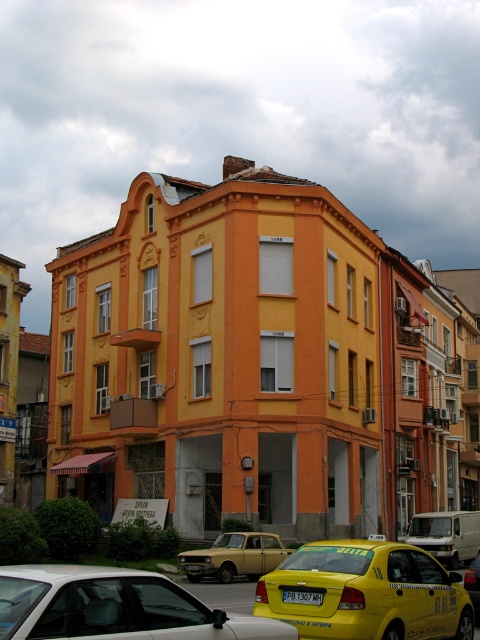
Question: Which of the following is the closest to the observer?

Choices:
 (A) yellow metallic taxi at center
 (B) yellow matte taxi at center

Answer: (B)

Question: Estimate the real-world distances between objects in this image. Which object is farther from the yellow metallic taxi at center?

Choices:
 (A) yellow matte taxi at lower right
 (B) yellow matte taxi at lower center
 (C) gold metallic sedan at center

Answer: (A)

Question: Which is farther from the gold metallic sedan at center?

Choices:
 (A) yellow matte taxi at lower center
 (B) yellow metallic taxi at center
 (C) yellow matte taxi at lower right

Answer: (C)

Question: Where is yellow metallic taxi at center located in relation to yellow matte taxi at center in the image?

Choices:
 (A) left
 (B) right

Answer: (B)

Question: Observing the image, what is the correct spatial positioning of yellow matte taxi at lower center in reference to yellow matte taxi at center?

Choices:
 (A) below
 (B) above

Answer: (B)

Question: Can you confirm if yellow matte taxi at lower right is bigger than gold metallic sedan at center?

Choices:
 (A) yes
 (B) no

Answer: (A)